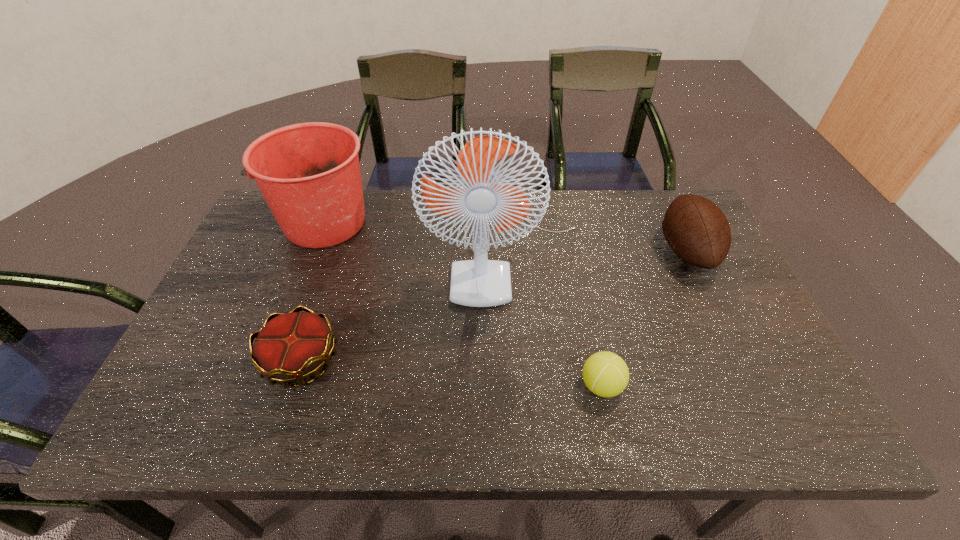
Identify the location of unoccupied position between the tennis ball and the football. (644, 319).

Locate an element on the screen. This screenshot has height=540, width=960. free space between the tennis ball and the crown is located at coordinates (451, 373).

Identify the location of free space between the fan and the tennis ball. The image size is (960, 540). (554, 320).

You are a GUI agent. You are given a task and a screenshot of the screen. Output one action in this format:
    pyautogui.click(x=<x>, y=<y>)
    Task: Click on the free space between the bucket and the tallest object
    This screenshot has height=540, width=960.
    Given the screenshot: What is the action you would take?
    pyautogui.click(x=415, y=239)

You are a GUI agent. You are given a task and a screenshot of the screen. Output one action in this format:
    pyautogui.click(x=<x>, y=<y>)
    Task: Click on the vacant area that lies between the tallest object and the rightmost object
    
    Given the screenshot: What is the action you would take?
    click(x=596, y=253)

Identify the location of unoccupied position between the tallest object and the tennis ball. (554, 320).

Find the location of `vacant space in between the rightmost object and the tennis ball`. vacant space in between the rightmost object and the tennis ball is located at coordinates (644, 319).

Identify which object is located as the nearest to the rightmost object. Please provide its 2D coordinates. Your answer should be formatted as a tuple, i.e. [(x, y)], where the tuple contains the x and y coordinates of a point satisfying the conditions above.

[(480, 282)]

Identify which object is the third closest to the bucket. Please provide its 2D coordinates. Your answer should be formatted as a tuple, i.e. [(x, y)], where the tuple contains the x and y coordinates of a point satisfying the conditions above.

[(605, 374)]

Find the location of `vacant space that satisfies the following two spatial constraints: 1. on the laces of the rightmost object; 2. on the front-facing side of the tallest object`. vacant space that satisfies the following two spatial constraints: 1. on the laces of the rightmost object; 2. on the front-facing side of the tallest object is located at coordinates (687, 254).